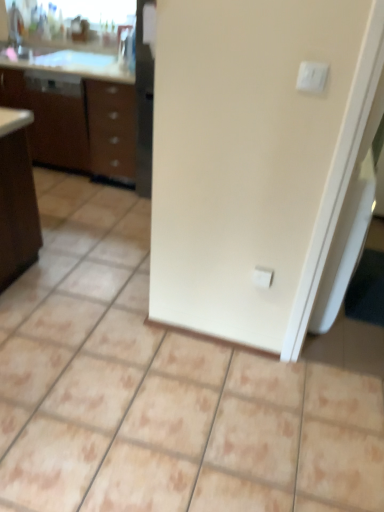
Question: From the image's perspective, does white glossy sink at upper left appear lower than white plastic light switch at upper right?

Choices:
 (A) yes
 (B) no

Answer: (B)

Question: Is white glossy sink at upper left positioned beyond the bounds of white plastic light switch at upper right?

Choices:
 (A) no
 (B) yes

Answer: (B)

Question: Is white glossy sink at upper left facing away from white plastic light switch at upper right?

Choices:
 (A) no
 (B) yes

Answer: (A)

Question: Is white glossy sink at upper left at the right side of white plastic light switch at upper right?

Choices:
 (A) yes
 (B) no

Answer: (B)

Question: Is white glossy sink at upper left beside white plastic light switch at upper right?

Choices:
 (A) no
 (B) yes

Answer: (A)

Question: Considering the relative sizes of white glossy sink at upper left and white plastic light switch at upper right in the image provided, is white glossy sink at upper left thinner than white plastic light switch at upper right?

Choices:
 (A) yes
 (B) no

Answer: (B)

Question: Is white plastic electric outlet at center located within white plastic light switch at upper right?

Choices:
 (A) no
 (B) yes

Answer: (A)

Question: Is white plastic light switch at upper right shorter than white plastic electric outlet at center?

Choices:
 (A) yes
 (B) no

Answer: (A)

Question: From a real-world perspective, is white plastic light switch at upper right physically below white plastic electric outlet at center?

Choices:
 (A) yes
 (B) no

Answer: (B)

Question: Is white plastic light switch at upper right next to white plastic electric outlet at center?

Choices:
 (A) no
 (B) yes

Answer: (A)

Question: Considering the relative sizes of white plastic light switch at upper right and white plastic electric outlet at center in the image provided, is white plastic light switch at upper right smaller than white plastic electric outlet at center?

Choices:
 (A) no
 (B) yes

Answer: (B)

Question: Is white plastic light switch at upper right bigger than white plastic electric outlet at center?

Choices:
 (A) yes
 (B) no

Answer: (B)

Question: From the image's perspective, is white plastic electric outlet at center below white glossy sink at upper left?

Choices:
 (A) yes
 (B) no

Answer: (A)